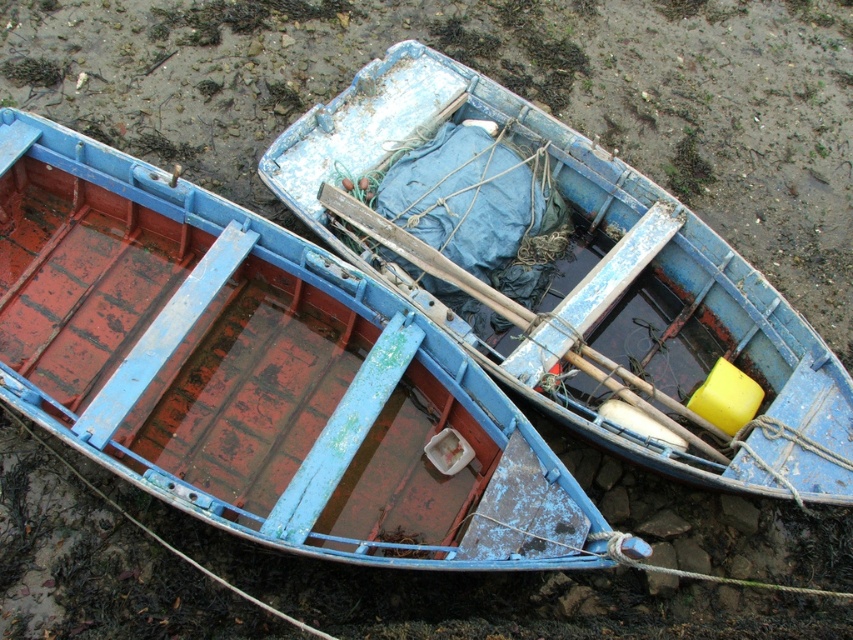
Question: Which point is farther from the camera taking this photo?

Choices:
 (A) (529, 145)
 (B) (138, 384)

Answer: (A)

Question: Can you confirm if rusty metal boat at lower left is wider than blue painted wood boat at center?

Choices:
 (A) yes
 (B) no

Answer: (A)

Question: Is rusty metal boat at lower left smaller than blue painted wood boat at center?

Choices:
 (A) yes
 (B) no

Answer: (B)

Question: Considering the relative positions of rusty metal boat at lower left and blue painted wood boat at center in the image provided, where is rusty metal boat at lower left located with respect to blue painted wood boat at center?

Choices:
 (A) left
 (B) right

Answer: (A)

Question: Which point appears farthest from the camera in this image?

Choices:
 (A) (363, 541)
 (B) (711, 248)

Answer: (B)